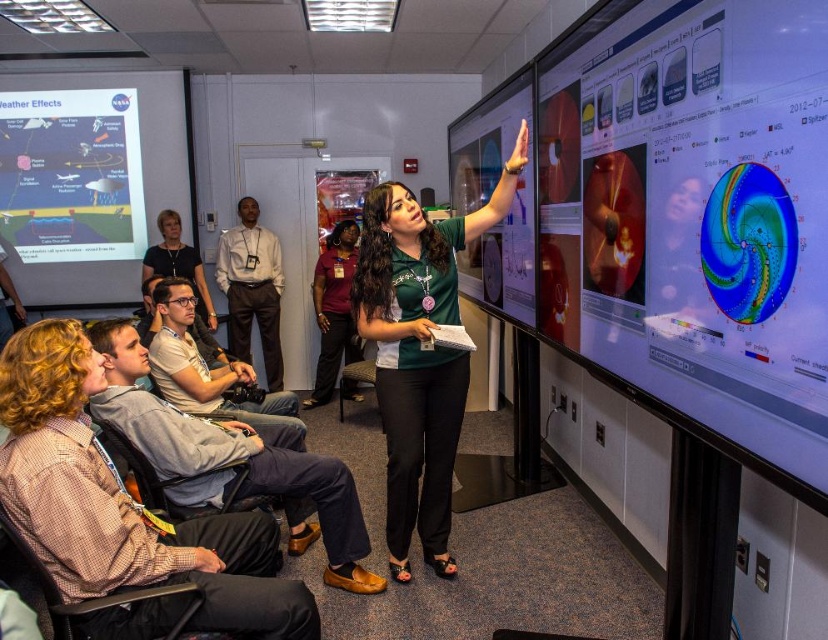
Question: Which point is closer to the camera?

Choices:
 (A) (477, 124)
 (B) (162, 580)
 (C) (733, 90)
 (D) (360, 317)

Answer: (C)

Question: Which point appears farthest from the camera in this image?

Choices:
 (A) (388, 364)
 (B) (111, 577)
 (C) (737, 406)

Answer: (A)

Question: Does matte white paper at upper left come behind matte plastic screen at upper right?

Choices:
 (A) yes
 (B) no

Answer: (A)

Question: Does shiny metallic screen at upper right have a smaller size compared to matte white paper at upper left?

Choices:
 (A) no
 (B) yes

Answer: (A)

Question: Based on their relative distances, which object is nearer to the green matte shirt at center?

Choices:
 (A) green fabric shirt at upper center
 (B) shiny metallic screen at upper right

Answer: (B)

Question: Does shiny metallic screen at upper right have a greater width compared to matte plastic screen at upper right?

Choices:
 (A) yes
 (B) no

Answer: (B)